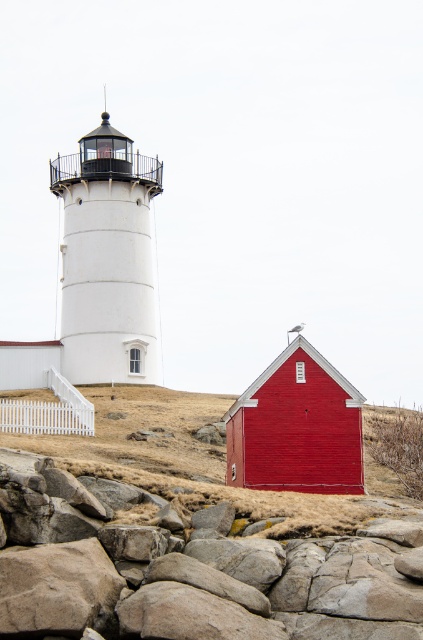
Question: Does gray rough rock at lower left have a greater width compared to smooth red barn at center?

Choices:
 (A) no
 (B) yes

Answer: (A)

Question: Is gray rough rock at lower left positioned behind smooth red barn at center?

Choices:
 (A) yes
 (B) no

Answer: (B)

Question: Does gray rough rock at lower left appear on the left side of smooth red barn at center?

Choices:
 (A) no
 (B) yes

Answer: (A)

Question: Which object is closer to the camera taking this photo?

Choices:
 (A) smooth red barn at center
 (B) gray rough rock at lower left

Answer: (B)